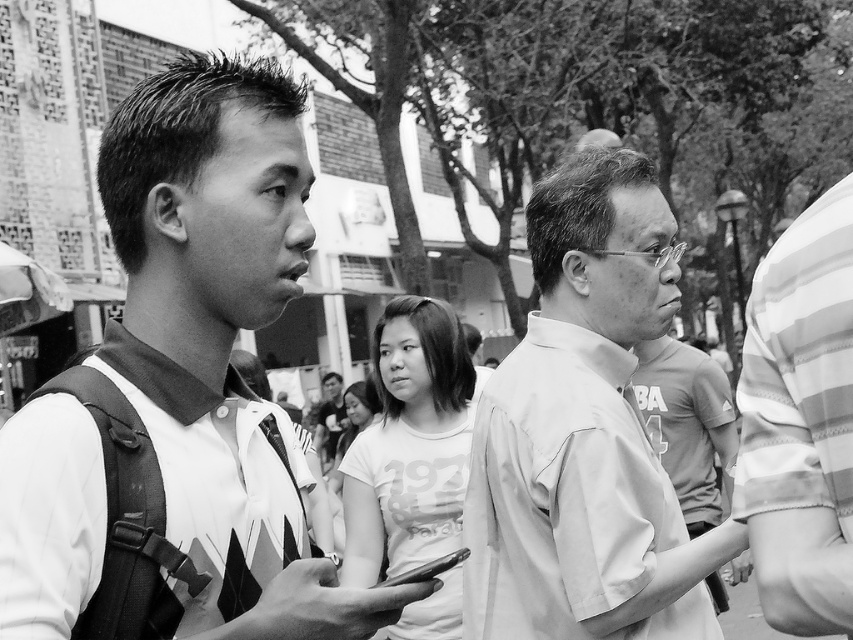
In the image, where is the light gray shirt at center located in terms of coordinates?

The light gray shirt at center is located at coordinates point (585,433).